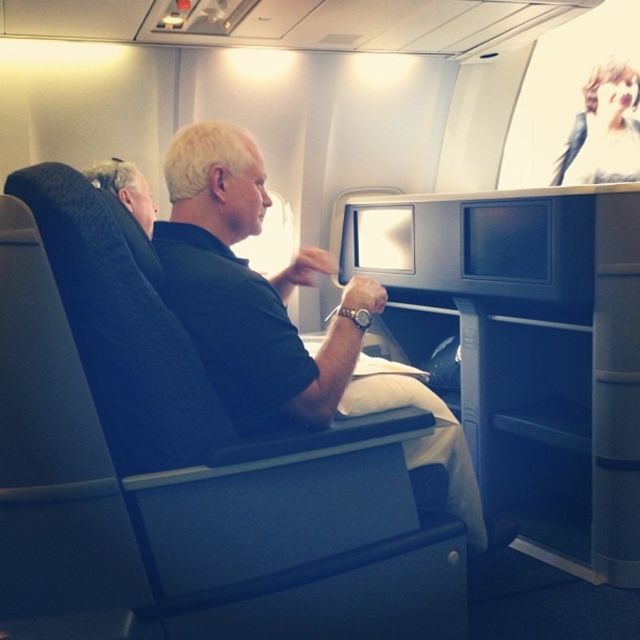
Between black fabric shirt at center and blonde hair at upper left, which one has more height?

black fabric shirt at center

At what (x,y) coordinates should I click in order to perform the action: click on black fabric shirt at center. Please return your answer as a coordinate pair (x, y). Image resolution: width=640 pixels, height=640 pixels. Looking at the image, I should click on [x=284, y=317].